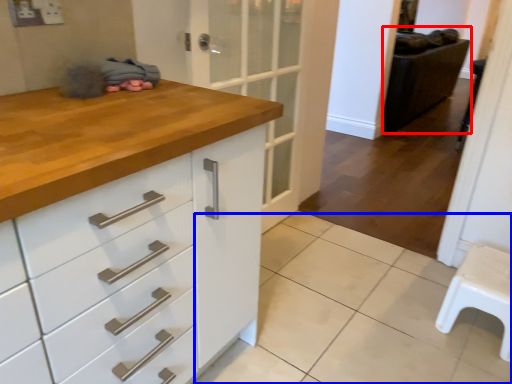
Question: Which object appears farthest to the camera in this image, chair (highlighted by a red box) or tile (highlighted by a blue box)?

Choices:
 (A) chair
 (B) tile

Answer: (A)